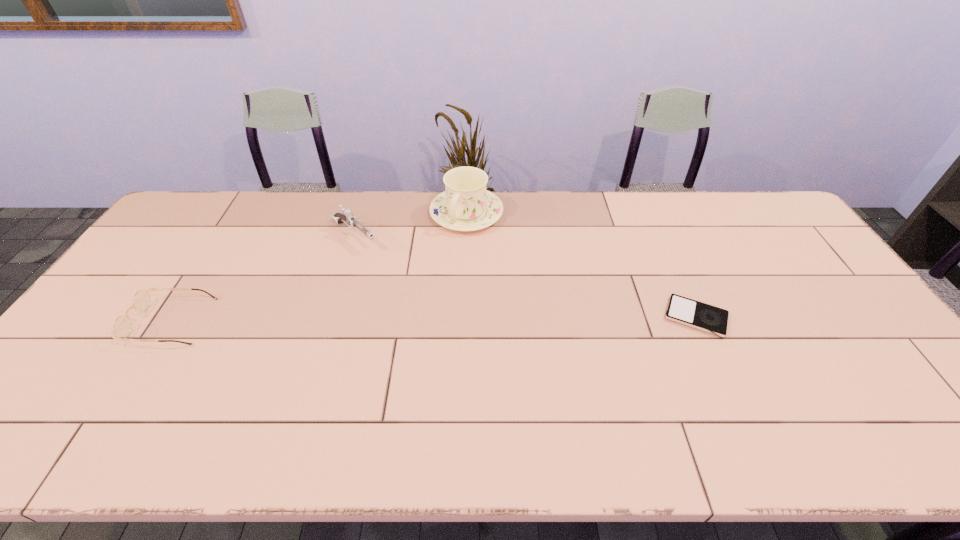
You are a GUI agent. You are given a task and a screenshot of the screen. Output one action in this format:
    pyautogui.click(x=<x>, y=<y>)
    Task: Click on the free location located 0.060m aimed along the barrel of the gun
    The image size is (960, 540).
    Given the screenshot: What is the action you would take?
    pyautogui.click(x=380, y=258)

Locate an element on the screen. This screenshot has width=960, height=540. free space located 0.110m aimed along the barrel of the gun is located at coordinates (390, 265).

Identify the location of vacant space situated on the handle side of the tallest object. (409, 306).

The height and width of the screenshot is (540, 960). Identify the location of vacant area situated on the handle side of the tallest object. (404, 314).

The width and height of the screenshot is (960, 540). What are the coordinates of `free region located 0.240m on the handle side of the tallest object` in the screenshot? It's located at (422, 285).

You are a GUI agent. You are given a task and a screenshot of the screen. Output one action in this format:
    pyautogui.click(x=<x>, y=<y>)
    Task: Click on the gun at the far edge
    This screenshot has width=960, height=540.
    Given the screenshot: What is the action you would take?
    pyautogui.click(x=347, y=217)

You are a GUI agent. You are given a task and a screenshot of the screen. Output one action in this format:
    pyautogui.click(x=<x>, y=<y>)
    Task: Click on the chinaware situated at the far edge
    The height and width of the screenshot is (540, 960).
    Given the screenshot: What is the action you would take?
    pyautogui.click(x=466, y=205)

Image resolution: width=960 pixels, height=540 pixels. Find the location of `object located at the left edge`. object located at the left edge is located at coordinates pyautogui.click(x=122, y=328).

At what (x,y) coordinates should I click in order to perform the action: click on vacant region at the far edge. Please return your answer as a coordinate pair (x, y). The height and width of the screenshot is (540, 960). Looking at the image, I should click on (684, 227).

The height and width of the screenshot is (540, 960). In the image, there is a desktop. Identify the location of vacant space at the left edge. (x=160, y=259).